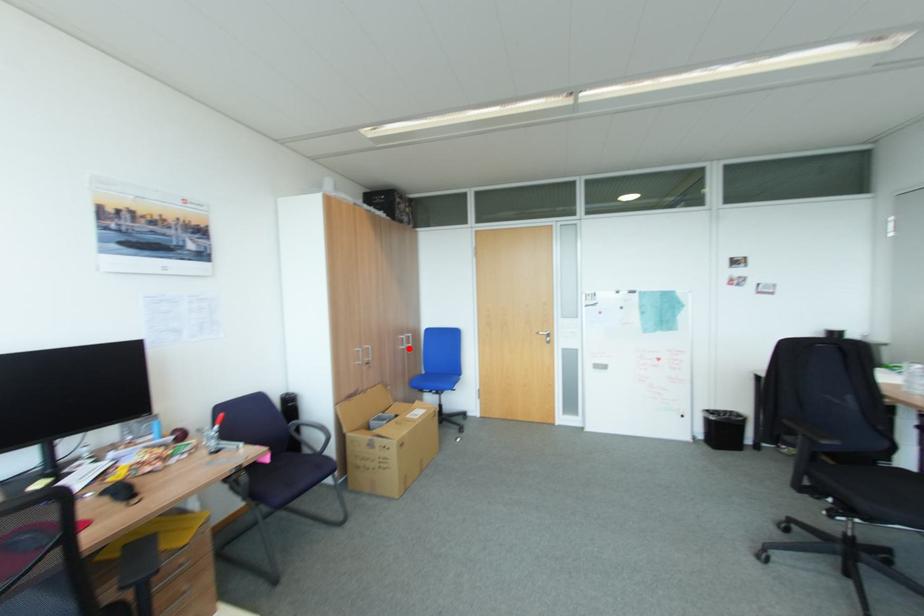
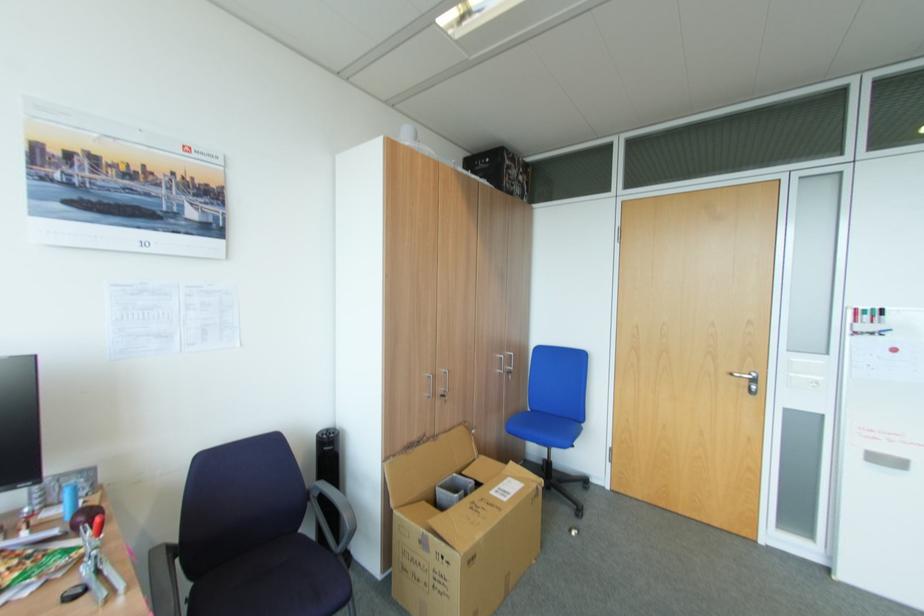
Find the pixel in the second image that matches the highlighted location in the first image.

(505, 371)